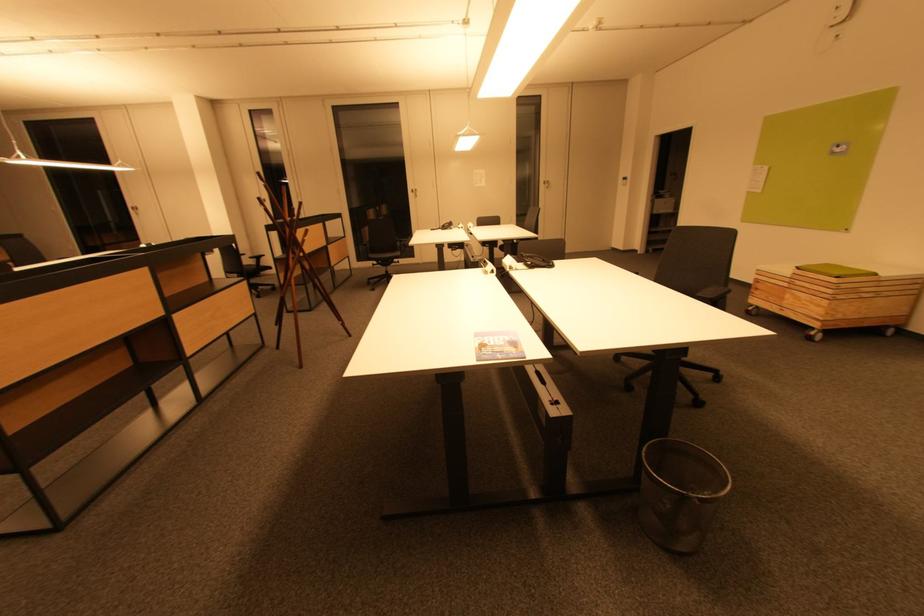
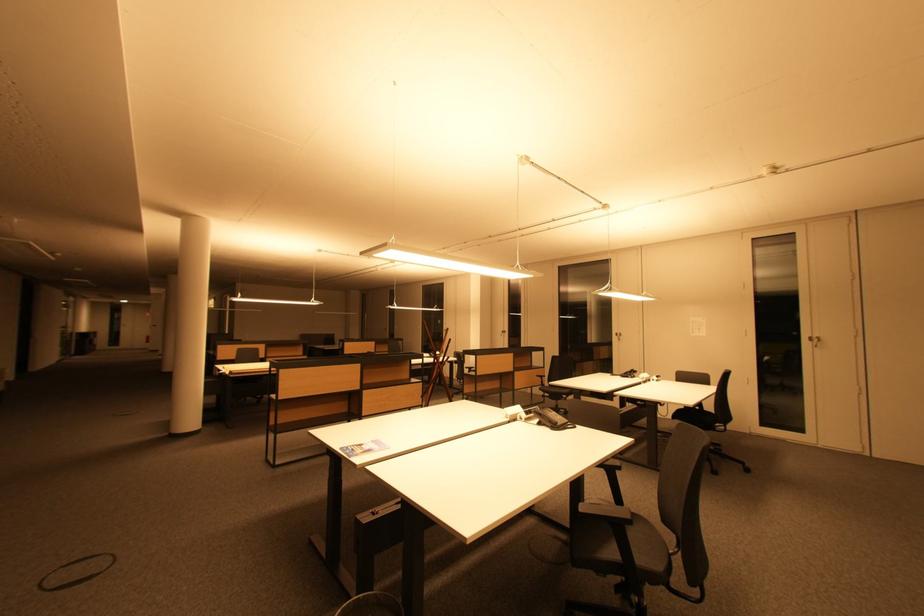
Locate, in the second image, the point that corresponds to point 453,228 in the first image.

(635, 376)